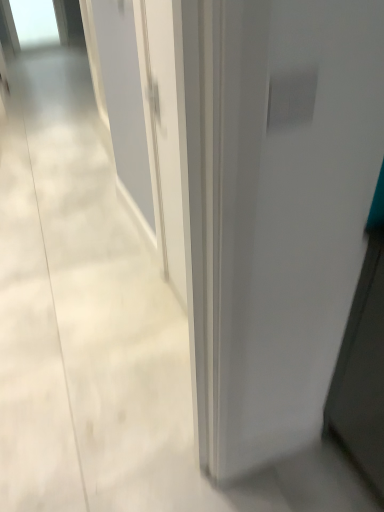
The width and height of the screenshot is (384, 512). I want to click on free space in front of white glossy door at center, so click(x=148, y=350).